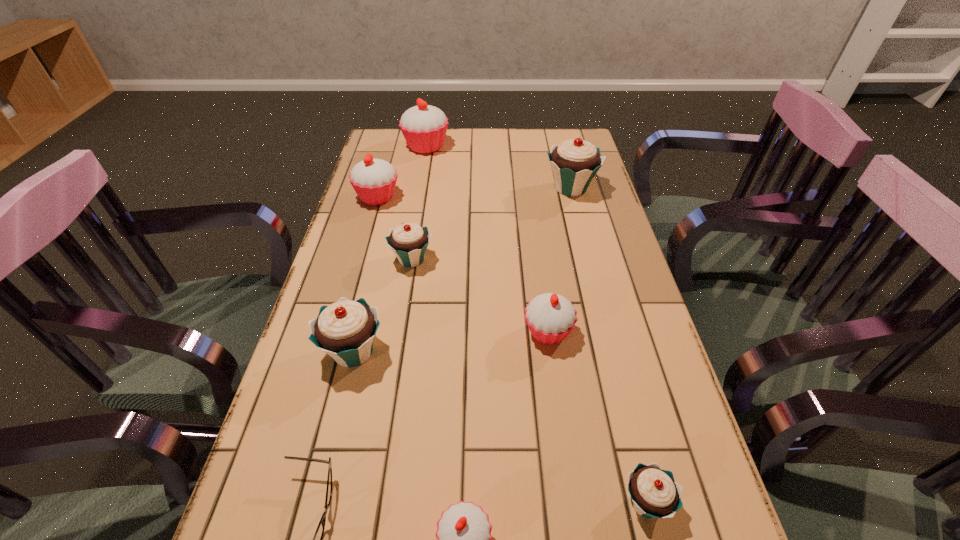
Image resolution: width=960 pixels, height=540 pixels. Identify the location of free space located on the right of the farthest object. (510, 146).

Locate an element on the screen. The height and width of the screenshot is (540, 960). free point located 0.400m on the left of the farthest teal cupcake is located at coordinates (420, 188).

Locate an element on the screen. This screenshot has height=540, width=960. free space located 0.350m on the front of the third nearest pink cupcake is located at coordinates (349, 296).

You are a GUI agent. You are given a task and a screenshot of the screen. Output one action in this format:
    pyautogui.click(x=<x>, y=<y>)
    Task: Click on the free spot located 0.130m on the back of the second biggest teal cupcake
    
    Given the screenshot: What is the action you would take?
    pyautogui.click(x=370, y=286)

Find the location of a particular element. blank space located on the left of the second nearest pink cupcake is located at coordinates (457, 332).

Identify the location of blank space located on the back of the fourth farthest cupcake. (420, 205).

Locate an element on the screen. vacant space located on the back of the smallest teal cupcake is located at coordinates (608, 348).

Where is `object present at the far edge`? The height and width of the screenshot is (540, 960). object present at the far edge is located at coordinates (424, 127).

The width and height of the screenshot is (960, 540). I want to click on object located at the far left corner, so click(x=424, y=127).

At what (x,y) coordinates should I click in order to perform the action: click on vacant space at the far edge of the desktop. Please return your answer as a coordinate pair (x, y). This screenshot has width=960, height=540. Looking at the image, I should click on (484, 147).